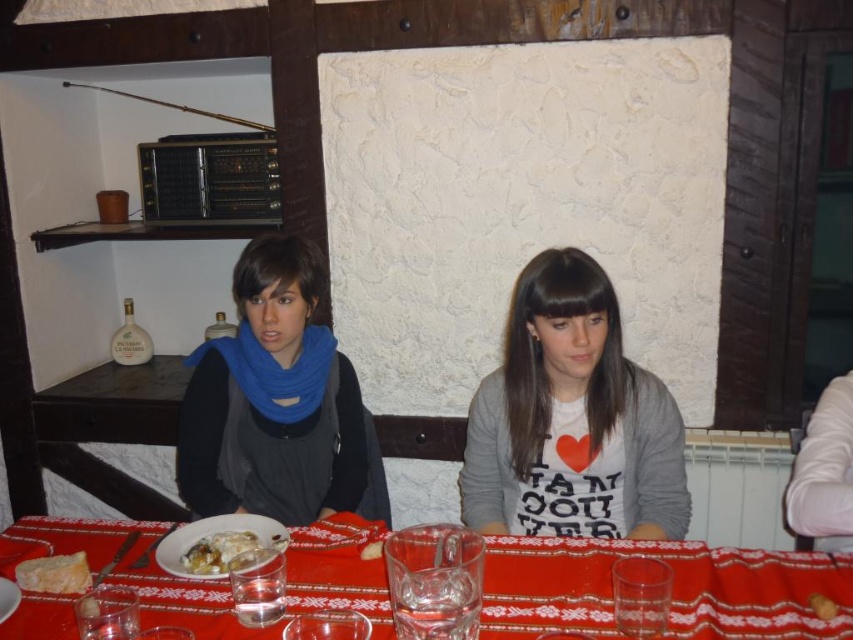
Is blue scarf at center above white glossy plate at center?

Yes.

Where is `blue scarf at center`? This screenshot has width=853, height=640. blue scarf at center is located at coordinates (271, 401).

Which is in front, point (366, 476) or point (258, 532)?

Point (258, 532) is in front.

The image size is (853, 640). I want to click on blue scarf at center, so click(271, 401).

Can you confirm if red fabric tablecloth at center is bigger than white glossy plate at center?

Correct, red fabric tablecloth at center is larger in size than white glossy plate at center.

Between point (700, 566) and point (173, 566), which one is positioned in front?

Point (700, 566) is more forward.

The height and width of the screenshot is (640, 853). I want to click on red fabric tablecloth at center, so point(672,589).

Which is below, white crumbly cheese at lower left or white creamy food at center?

white crumbly cheese at lower left

Based on the photo, is white crumbly cheese at lower left shorter than white creamy food at center?

In fact, white crumbly cheese at lower left may be taller than white creamy food at center.

Which is in front, point (49, 582) or point (242, 536)?

Point (49, 582) is in front.

Locate an element on the screen. The height and width of the screenshot is (640, 853). white crumbly cheese at lower left is located at coordinates (54, 573).